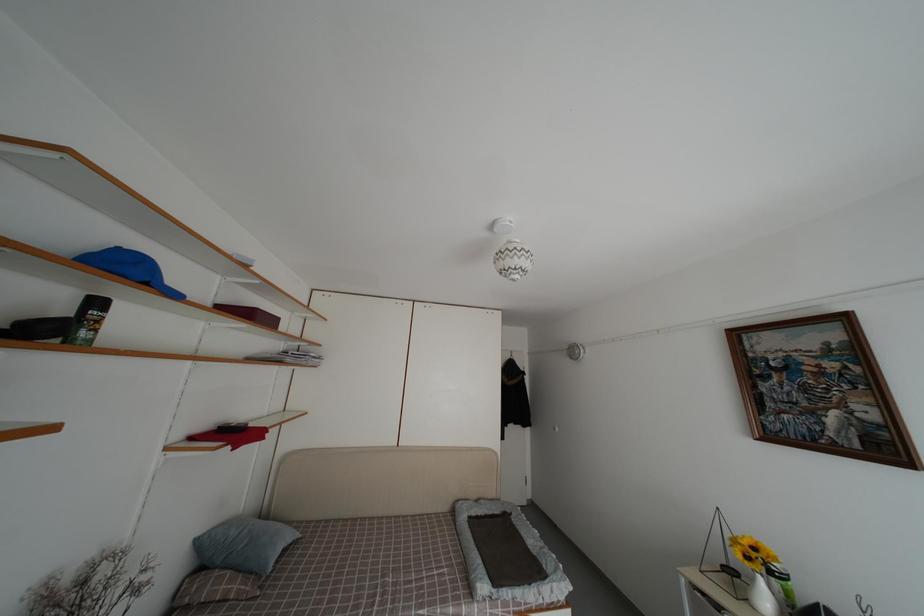
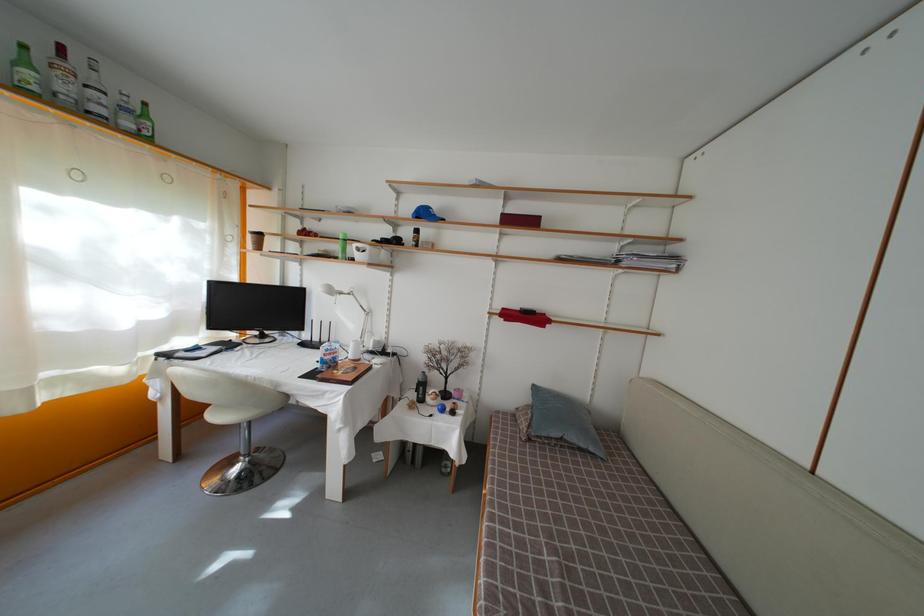
In the second image, find the point that corresponds to point 274,584 in the first image.

(550, 450)